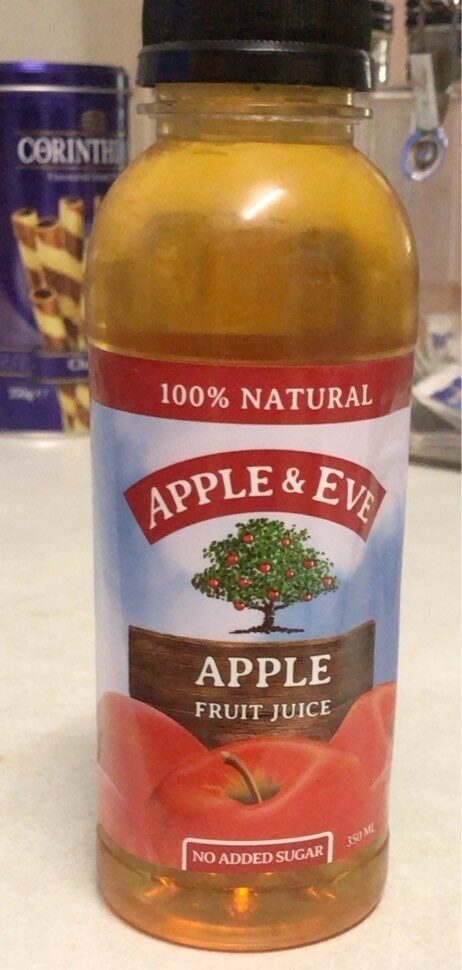
The image size is (462, 970). I want to click on bottle, so click(x=252, y=482).